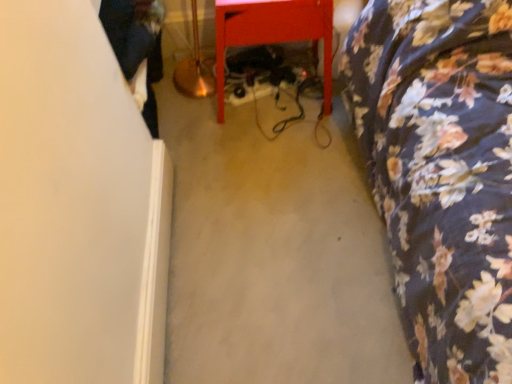
At what (x,y) coordinates should I click in order to perform the action: click on matte red table at center, which ranks as the second furniture in right-to-left order. Please return your answer as a coordinate pair (x, y). Looking at the image, I should click on (272, 33).

Identify the location of floral fabric bedspread at right, the 1th furniture when ordered from right to left. The height and width of the screenshot is (384, 512). (441, 173).

Looking at this image, what is the approximate height of floral fabric bedspread at right, the 1th furniture when ordered from right to left?

floral fabric bedspread at right, the 1th furniture when ordered from right to left, is 83.19 centimeters tall.

Find the location of a particular element. The height and width of the screenshot is (384, 512). matte red table at center, which ranks as the second furniture in right-to-left order is located at coordinates (272, 33).

Is floral fabric bedspread at right, the 1th furniture when ordered from right to left, positioned with its back to dark blue jeans at left?

No, floral fabric bedspread at right, the 1th furniture when ordered from right to left,'s orientation is not away from dark blue jeans at left.

In the image, is floral fabric bedspread at right, the 1th furniture when ordered from right to left, positioned in front of or behind dark blue jeans at left?

Clearly, floral fabric bedspread at right, the 1th furniture when ordered from right to left, is in front of dark blue jeans at left.

Is there a large distance between floral fabric bedspread at right, the 1th furniture when ordered from right to left, and dark blue jeans at left?

No, floral fabric bedspread at right, the 1th furniture when ordered from right to left, is in close proximity to dark blue jeans at left.

Which is farther from the camera, (x=404, y=315) or (x=308, y=34)?

Point (x=308, y=34)

Is floral fabric bedspread at right, placed as the 2th furniture when sorted from left to right, next to matte red table at center, which ranks as the second furniture in right-to-left order, and touching it?

No, floral fabric bedspread at right, placed as the 2th furniture when sorted from left to right, is not making contact with matte red table at center, which ranks as the second furniture in right-to-left order.

In the image, there is a floral fabric bedspread at right, the 1th furniture when ordered from right to left. Where is `furniture above it (from the image's perspective)`? furniture above it (from the image's perspective) is located at coordinates (272, 33).

Can you see matte red table at center, which ranks as the second furniture in right-to-left order, touching dark blue jeans at left?

matte red table at center, which ranks as the second furniture in right-to-left order, and dark blue jeans at left are not in contact.

The image size is (512, 384). I want to click on couple located underneath the matte red table at center, acting as the first furniture starting from the left (from a real-world perspective), so click(x=135, y=47).

Which object is further away from the camera taking this photo, matte red table at center, acting as the first furniture starting from the left, or dark blue jeans at left?

dark blue jeans at left.

Which of these two, matte red table at center, which ranks as the second furniture in right-to-left order, or dark blue jeans at left, is bigger?

With larger size is matte red table at center, which ranks as the second furniture in right-to-left order.

Which is in front, matte red table at center, acting as the first furniture starting from the left, or floral fabric bedspread at right, the 1th furniture when ordered from right to left?

floral fabric bedspread at right, the 1th furniture when ordered from right to left, is closer to the camera.

Is matte red table at center, which ranks as the second furniture in right-to-left order, facing towards floral fabric bedspread at right, placed as the 2th furniture when sorted from left to right?

No, matte red table at center, which ranks as the second furniture in right-to-left order, is not facing towards floral fabric bedspread at right, placed as the 2th furniture when sorted from left to right.

Considering the sizes of objects matte red table at center, acting as the first furniture starting from the left, and floral fabric bedspread at right, placed as the 2th furniture when sorted from left to right, in the image provided, who is shorter, matte red table at center, acting as the first furniture starting from the left, or floral fabric bedspread at right, placed as the 2th furniture when sorted from left to right,?

matte red table at center, acting as the first furniture starting from the left, is shorter.

Considering the relative sizes of matte red table at center, which ranks as the second furniture in right-to-left order, and floral fabric bedspread at right, the 1th furniture when ordered from right to left, in the image provided, is matte red table at center, which ranks as the second furniture in right-to-left order, thinner than floral fabric bedspread at right, the 1th furniture when ordered from right to left,?

Correct, the width of matte red table at center, which ranks as the second furniture in right-to-left order, is less than that of floral fabric bedspread at right, the 1th furniture when ordered from right to left.

How distant is dark blue jeans at left from floral fabric bedspread at right, the 1th furniture when ordered from right to left?

A distance of 34.59 inches exists between dark blue jeans at left and floral fabric bedspread at right, the 1th furniture when ordered from right to left.

Can you confirm if dark blue jeans at left is taller than floral fabric bedspread at right, the 1th furniture when ordered from right to left?

Incorrect, the height of dark blue jeans at left is not larger of that of floral fabric bedspread at right, the 1th furniture when ordered from right to left.

Considering the relative sizes of dark blue jeans at left and floral fabric bedspread at right, the 1th furniture when ordered from right to left, in the image provided, is dark blue jeans at left wider than floral fabric bedspread at right, the 1th furniture when ordered from right to left,?

No.

From a real-world perspective, is dark blue jeans at left located higher than floral fabric bedspread at right, placed as the 2th furniture when sorted from left to right?

No, from a real-world perspective, dark blue jeans at left is not above floral fabric bedspread at right, placed as the 2th furniture when sorted from left to right.

This screenshot has width=512, height=384. I want to click on couple lying above the matte red table at center, acting as the first furniture starting from the left (from the image's perspective), so click(x=135, y=47).

Which of these two, dark blue jeans at left or matte red table at center, which ranks as the second furniture in right-to-left order, is smaller?

dark blue jeans at left is smaller.

Considering the sizes of dark blue jeans at left and matte red table at center, which ranks as the second furniture in right-to-left order, in the image, is dark blue jeans at left taller or shorter than matte red table at center, which ranks as the second furniture in right-to-left order,?

→ dark blue jeans at left is shorter than matte red table at center, which ranks as the second furniture in right-to-left order.

Is dark blue jeans at left touching matte red table at center, acting as the first furniture starting from the left?

They are not placed beside each other.

The width and height of the screenshot is (512, 384). I want to click on couple above the floral fabric bedspread at right, the 1th furniture when ordered from right to left (from the image's perspective), so click(x=135, y=47).

Locate an element on the screen. Image resolution: width=512 pixels, height=384 pixels. furniture lying in front of the matte red table at center, which ranks as the second furniture in right-to-left order is located at coordinates (441, 173).

When comparing their distances from dark blue jeans at left, does matte red table at center, acting as the first furniture starting from the left, or floral fabric bedspread at right, the 1th furniture when ordered from right to left, seem closer?

matte red table at center, acting as the first furniture starting from the left, is closer to dark blue jeans at left.

Considering their positions, is dark blue jeans at left positioned closer to matte red table at center, acting as the first furniture starting from the left, than floral fabric bedspread at right, placed as the 2th furniture when sorted from left to right?

Based on the image, dark blue jeans at left appears to be nearer to matte red table at center, acting as the first furniture starting from the left.

Estimate the real-world distances between objects in this image. Which object is further from floral fabric bedspread at right, the 1th furniture when ordered from right to left, matte red table at center, acting as the first furniture starting from the left, or dark blue jeans at left?

dark blue jeans at left lies further to floral fabric bedspread at right, the 1th furniture when ordered from right to left, than the other object.

Based on their spatial positions, is floral fabric bedspread at right, placed as the 2th furniture when sorted from left to right, or matte red table at center, acting as the first furniture starting from the left, further from dark blue jeans at left?

floral fabric bedspread at right, placed as the 2th furniture when sorted from left to right, is positioned further to the anchor dark blue jeans at left.

From the image, which object appears to be nearer to matte red table at center, acting as the first furniture starting from the left, floral fabric bedspread at right, placed as the 2th furniture when sorted from left to right, or dark blue jeans at left?

dark blue jeans at left lies closer to matte red table at center, acting as the first furniture starting from the left, than the other object.

Looking at the image, which one is located closer to floral fabric bedspread at right, the 1th furniture when ordered from right to left, dark blue jeans at left or matte red table at center, which ranks as the second furniture in right-to-left order?

matte red table at center, which ranks as the second furniture in right-to-left order, lies closer to floral fabric bedspread at right, the 1th furniture when ordered from right to left, than the other object.

Find the location of `furniture located between dark blue jeans at left and floral fabric bedspread at right, placed as the 2th furniture when sorted from left to right, in the left-right direction`. furniture located between dark blue jeans at left and floral fabric bedspread at right, placed as the 2th furniture when sorted from left to right, in the left-right direction is located at coordinates (272, 33).